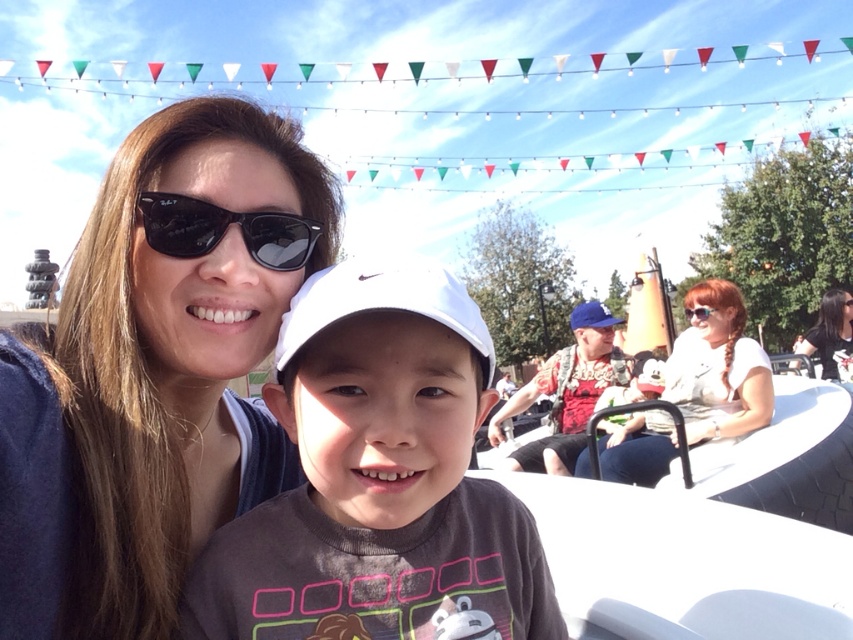
Question: Can you confirm if dark brown hair at upper right is positioned to the right of blue fabric baseball cap at center?

Choices:
 (A) yes
 (B) no

Answer: (A)

Question: Which point is farther to the camera?

Choices:
 (A) white fabric shirt at center
 (B) blue fabric baseball cap at center
 (C) dark brown hair at upper right

Answer: (C)

Question: Is white fabric shirt at center to the right of white matte baseball cap at center from the viewer's perspective?

Choices:
 (A) yes
 (B) no

Answer: (A)

Question: Considering the real-world distances, which object is farthest from the gray matte shirt at center?

Choices:
 (A) dark brown hair at upper right
 (B) matte black sunglasses at upper left
 (C) white matte baseball cap at center
 (D) black matte sunglasses at upper left

Answer: (A)

Question: Can you confirm if gray matte shirt at center is bigger than blue fabric baseball cap at center?

Choices:
 (A) yes
 (B) no

Answer: (B)

Question: Estimate the real-world distances between objects in this image. Which object is closer to the dark brown hair at upper right?

Choices:
 (A) blue fabric baseball cap at center
 (B) black matte sunglasses at upper left
 (C) gray matte shirt at center

Answer: (A)